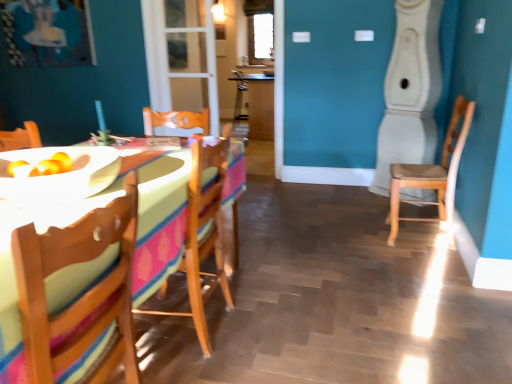
What do you see at coordinates (82, 295) in the screenshot?
I see `wooden chair at left, the first chair viewed from the left` at bounding box center [82, 295].

Describe the element at coordinates (256, 104) in the screenshot. The width and height of the screenshot is (512, 384). I see `wooden table at center` at that location.

Describe the element at coordinates (59, 175) in the screenshot. This screenshot has height=384, width=512. I see `white glossy bowl at center` at that location.

Where is `white glossy bowl at center`? The image size is (512, 384). white glossy bowl at center is located at coordinates (59, 175).

What do you see at coordinates (160, 222) in the screenshot? The image size is (512, 384). I see `wooden table at left` at bounding box center [160, 222].

Measure the distance between point [251,50] and camera.

6.17 meters.

What do you see at coordinates (433, 176) in the screenshot?
I see `wooden chair at right, which ranks as the first chair in back-to-front order` at bounding box center [433, 176].

The width and height of the screenshot is (512, 384). I want to click on wooden chair at left, which ranks as the third chair in right-to-left order, so click(82, 295).

Can you confirm if wooden chair at left, which is counted as the third chair, starting from the back, is positioned to the left of white glossy bowl at center?

No.

Considering the points (40, 346) and (74, 192), which point is behind, point (40, 346) or point (74, 192)?

The point (74, 192) is behind.

Can you tell me how much wooden chair at left, which is counted as the first chair, starting from the front, and white glossy bowl at center differ in facing direction?

The facing directions of wooden chair at left, which is counted as the first chair, starting from the front, and white glossy bowl at center are 179 degrees apart.

From the image's perspective, is wooden table at center positioned above or below white glossy bowl at center?

Clearly, from the image's perspective, wooden table at center is above white glossy bowl at center.

Is point (247, 105) closer or farther from the camera than point (46, 151)?

Point (247, 105) is positioned farther from the camera compared to point (46, 151).

This screenshot has width=512, height=384. I want to click on bowl in front of the wooden table at center, so click(59, 175).

Is wooden table at center positioned with its back to wooden chair at center, the second chair viewed from the left?

No, wooden table at center's orientation is not away from wooden chair at center, the second chair viewed from the left.

Which is more to the right, wooden table at center or wooden chair at center, placed as the 2th chair when sorted from right to left?

wooden table at center is more to the right.

Is the depth of wooden table at center greater than that of wooden chair at center, placed as the 2th chair when sorted from right to left?

Yes, it is behind wooden chair at center, placed as the 2th chair when sorted from right to left.

Image resolution: width=512 pixels, height=384 pixels. What are the coordinates of `the 2nd chair located beneath the wooden table at center (from a real-world perspective)` in the screenshot? It's located at [x=203, y=234].

Which object is positioned more to the right, wooden chair at right, the 1th chair in the right-to-left sequence, or wooden chair at center, the second chair viewed from the left?

From the viewer's perspective, wooden chair at right, the 1th chair in the right-to-left sequence, appears more on the right side.

From the image's perspective, is wooden chair at right, the 1th chair in the right-to-left sequence, on wooden chair at center, the second chair in the front-to-back sequence?

Yes, from the image's perspective, wooden chair at right, the 1th chair in the right-to-left sequence, is on top of wooden chair at center, the second chair in the front-to-back sequence.

Who is more distant, wooden chair at right, acting as the third chair starting from the left, or wooden chair at center, which ranks as the 2th chair in back-to-front order?

Positioned behind is wooden chair at right, acting as the third chair starting from the left.

Looking at the image, does wooden chair at right, the 3th chair viewed from the front, seem bigger or smaller compared to wooden chair at center, which ranks as the 2th chair in back-to-front order?

wooden chair at right, the 3th chair viewed from the front, is smaller than wooden chair at center, which ranks as the 2th chair in back-to-front order.

From the image's perspective, who appears lower, white glossy bowl at center or transparent glass door at center?

white glossy bowl at center is shown below in the image.

Is white glossy bowl at center at the right side of transparent glass door at center?

No.

Considering the positions of point (80, 177) and point (151, 16), is point (80, 177) closer or farther from the camera than point (151, 16)?

Point (80, 177).

Is white glossy bowl at center surrounding transparent glass door at center?

No, transparent glass door at center is located outside of white glossy bowl at center.

How far apart are wooden chair at center, which ranks as the 2th chair in back-to-front order, and white glossy bowl at center?

A distance of 50.00 centimeters exists between wooden chair at center, which ranks as the 2th chair in back-to-front order, and white glossy bowl at center.

From the image's perspective, is wooden chair at center, which ranks as the 2th chair in back-to-front order, on white glossy bowl at center?

Actually, wooden chair at center, which ranks as the 2th chair in back-to-front order, appears below white glossy bowl at center in the image.

Which object is further away from the camera, wooden chair at center, which ranks as the 2th chair in back-to-front order, or white glossy bowl at center?

Positioned behind is wooden chair at center, which ranks as the 2th chair in back-to-front order.

Would you say wooden chair at center, which ranks as the 2th chair in back-to-front order, is to the left or to the right of white glossy bowl at center in the picture?

From the image, it's evident that wooden chair at center, which ranks as the 2th chair in back-to-front order, is to the right of white glossy bowl at center.

How much distance is there between wooden chair at left, which is counted as the third chair, starting from the back, and clear glass window at upper center?

wooden chair at left, which is counted as the third chair, starting from the back, and clear glass window at upper center are 17.20 feet apart.

Does wooden chair at left, which is counted as the third chair, starting from the back, lie behind clear glass window at upper center?

No, the depth of wooden chair at left, which is counted as the third chair, starting from the back, is less than that of clear glass window at upper center.

In the scene shown: Considering the sizes of objects wooden chair at left, which is counted as the third chair, starting from the back, and clear glass window at upper center in the image provided, who is taller, wooden chair at left, which is counted as the third chair, starting from the back, or clear glass window at upper center?

clear glass window at upper center.

Is point (33, 335) positioned in front of point (256, 54)?

Yes, point (33, 335) is in front of point (256, 54).

Find the location of `bowl located on the left of wooden chair at left, which is counted as the third chair, starting from the back`. bowl located on the left of wooden chair at left, which is counted as the third chair, starting from the back is located at coordinates (59, 175).

The width and height of the screenshot is (512, 384). Identify the location of table that appears above the white glossy bowl at center (from the image's perspective). (256, 104).

Which object lies further to the anchor point wooden table at center, wooden chair at center, placed as the 2th chair when sorted from right to left, or clear glass window at upper center?

wooden chair at center, placed as the 2th chair when sorted from right to left, lies further to wooden table at center than the other object.

Estimate the real-world distances between objects in this image. Which object is further from wooden chair at right, the 3th chair viewed from the front, wooden table at center or wooden table at left?

wooden table at center lies further to wooden chair at right, the 3th chair viewed from the front, than the other object.

Consider the image. Considering their positions, is wooden chair at left, the first chair viewed from the left, positioned closer to wooden chair at right, acting as the third chair starting from the left, than white glossy bowl at center?

white glossy bowl at center.

Looking at the image, which one is located further to wooden table at center, wooden chair at left, which is counted as the first chair, starting from the front, or clear glass window at upper center?

wooden chair at left, which is counted as the first chair, starting from the front, is positioned further to the anchor wooden table at center.

Considering their positions, is wooden table at center positioned further to wooden chair at right, acting as the third chair starting from the left, than white glossy bowl at center?

The object further to wooden chair at right, acting as the third chair starting from the left, is wooden table at center.

From the image, which object appears to be farther from wooden table at left, wooden chair at center, which ranks as the 2th chair in back-to-front order, or wooden chair at right, acting as the third chair starting from the left?

wooden chair at right, acting as the third chair starting from the left, is positioned further to the anchor wooden table at left.

Which object lies nearer to the anchor point wooden table at left, wooden chair at left, which is counted as the first chair, starting from the front, or clear glass window at upper center?

Based on the image, wooden chair at left, which is counted as the first chair, starting from the front, appears to be nearer to wooden table at left.

From the image, which object appears to be farther from wooden table at left, wooden chair at right, which ranks as the first chair in back-to-front order, or transparent glass door at center?

transparent glass door at center.

Identify the location of glass door positioned between wooden chair at right, which ranks as the first chair in back-to-front order, and clear glass window at upper center from near to far. The height and width of the screenshot is (384, 512). (181, 56).

You are a GUI agent. You are given a task and a screenshot of the screen. Output one action in this format:
    pyautogui.click(x=<x>, y=<y>)
    Task: Click on the chair positioned between wooden chair at center, the second chair viewed from the left, and clear glass window at upper center from near to far
    Image resolution: width=512 pixels, height=384 pixels.
    Given the screenshot: What is the action you would take?
    pyautogui.click(x=433, y=176)

Locate an element on the screen. This screenshot has width=512, height=384. glass door positioned between wooden chair at center, placed as the 2th chair when sorted from right to left, and clear glass window at upper center from near to far is located at coordinates (181, 56).

You are a GUI agent. You are given a task and a screenshot of the screen. Output one action in this format:
    pyautogui.click(x=<x>, y=<y>)
    Task: Click on the glass door positioned between white glossy bowl at center and wooden table at center from near to far
    Image resolution: width=512 pixels, height=384 pixels.
    Given the screenshot: What is the action you would take?
    pyautogui.click(x=181, y=56)